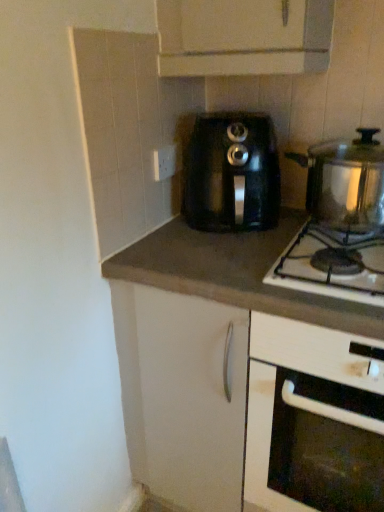
Question: From the image's perspective, is black plastic coffee maker at center, which is counted as the 1th kitchen appliance, starting from the left, located above or below matte gray countertop at center?

Choices:
 (A) above
 (B) below

Answer: (A)

Question: From a real-world perspective, relative to matte gray countertop at center, is black plastic coffee maker at center, placed as the second kitchen appliance when sorted from right to left, vertically above or below?

Choices:
 (A) above
 (B) below

Answer: (A)

Question: Which of these objects is positioned closest to the matte gray countertop at center?

Choices:
 (A) white glossy oven at lower right
 (B) stainless steel gas stove at right
 (C) satin silver pot at right, the 2th kitchen appliance from the left
 (D) black plastic coffee maker at center, which is counted as the 1th kitchen appliance, starting from the left
 (E) white plastic electric outlet at upper center

Answer: (B)

Question: Estimate the real-world distances between objects in this image. Which object is closer to the white plastic electric outlet at upper center?

Choices:
 (A) stainless steel gas stove at right
 (B) white glossy oven at lower right
 (C) satin silver pot at right, the 2th kitchen appliance from the left
 (D) matte gray countertop at center
 (E) black plastic coffee maker at center, which is counted as the 1th kitchen appliance, starting from the left

Answer: (E)